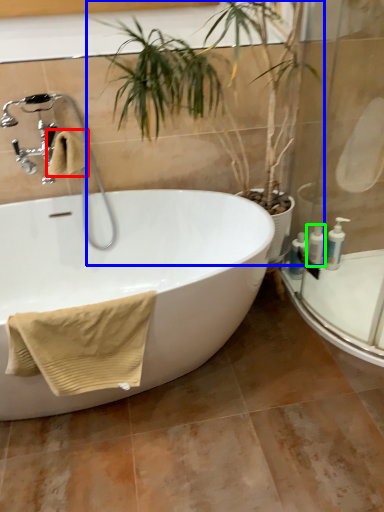
Question: Estimate the real-world distances between objects in this image. Which object is closer to bath towel (highlighted by a red box), houseplant (highlighted by a blue box) or toiletry (highlighted by a green box)?

Choices:
 (A) houseplant
 (B) toiletry

Answer: (A)